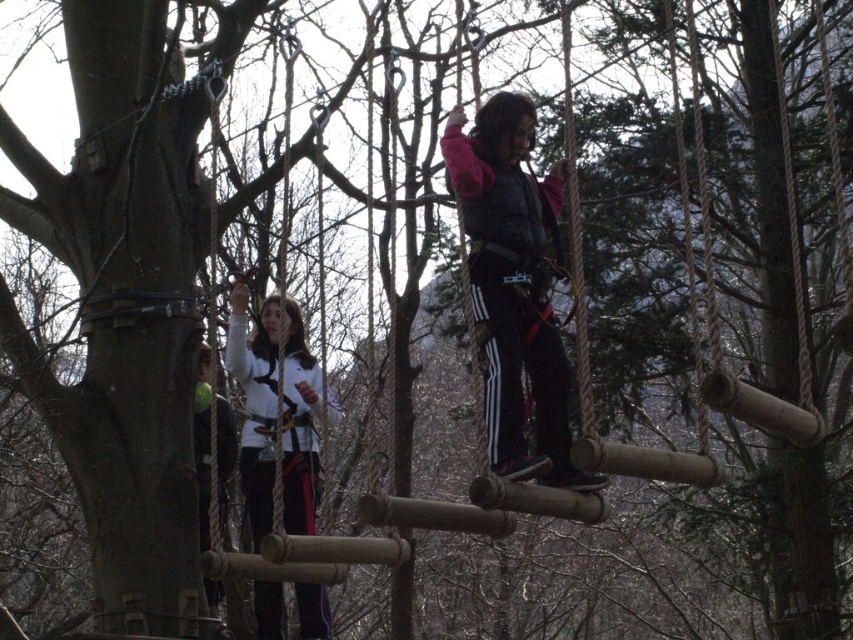
Question: Does black matte pants at center have a larger size compared to white matte jacket at center?

Choices:
 (A) no
 (B) yes

Answer: (A)

Question: Does black matte pants at center appear on the left side of white fabric jacket at center?

Choices:
 (A) no
 (B) yes

Answer: (A)

Question: Which of the following is the farthest from the observer?

Choices:
 (A) white matte jacket at center
 (B) black matte pants at center
 (C) white fabric jacket at center

Answer: (C)

Question: Does black matte pants at center appear on the left side of white matte jacket at center?

Choices:
 (A) yes
 (B) no

Answer: (B)

Question: Which point is farther from the camera taking this photo?

Choices:
 (A) (202, 529)
 (B) (555, 209)

Answer: (A)

Question: Which point is closer to the camera taking this photo?

Choices:
 (A) (242, 378)
 (B) (509, 291)
 (C) (225, 413)

Answer: (B)